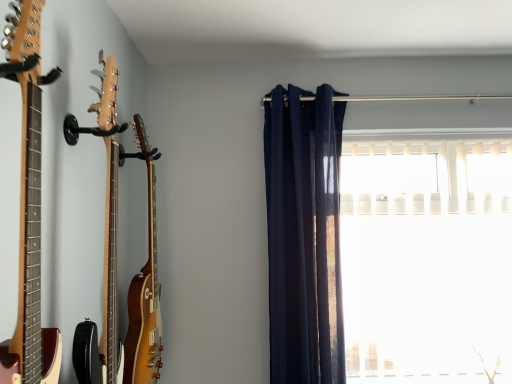
Question: Could navy blue fabric curtain at center be considered to be inside white plastic blinds at right?

Choices:
 (A) yes
 (B) no

Answer: (B)

Question: From the image's perspective, is white plastic blinds at right on top of navy blue fabric curtain at center?

Choices:
 (A) no
 (B) yes

Answer: (A)

Question: Considering the relative sizes of white plastic blinds at right and navy blue fabric curtain at center in the image provided, is white plastic blinds at right taller than navy blue fabric curtain at center?

Choices:
 (A) yes
 (B) no

Answer: (B)

Question: Is white plastic blinds at right wider than navy blue fabric curtain at center?

Choices:
 (A) no
 (B) yes

Answer: (A)

Question: Does white plastic blinds at right have a lesser height compared to navy blue fabric curtain at center?

Choices:
 (A) yes
 (B) no

Answer: (A)

Question: Is white plastic blinds at right not inside navy blue fabric curtain at center?

Choices:
 (A) no
 (B) yes

Answer: (B)

Question: From the image's perspective, is navy blue fabric curtain at center located above glossy wood guitar at left, positioned as the third guitar in front-to-back order?

Choices:
 (A) no
 (B) yes

Answer: (B)

Question: Considering the relative sizes of navy blue fabric curtain at center and glossy wood guitar at left, which is counted as the 1th guitar, starting from the back, in the image provided, is navy blue fabric curtain at center bigger than glossy wood guitar at left, which is counted as the 1th guitar, starting from the back,?

Choices:
 (A) yes
 (B) no

Answer: (A)

Question: Does navy blue fabric curtain at center have a lesser height compared to glossy wood guitar at left, positioned as the third guitar in front-to-back order?

Choices:
 (A) no
 (B) yes

Answer: (A)

Question: From a real-world perspective, is navy blue fabric curtain at center located beneath glossy wood guitar at left, which is counted as the 1th guitar, starting from the back?

Choices:
 (A) yes
 (B) no

Answer: (B)

Question: Can you confirm if navy blue fabric curtain at center is taller than glossy wood guitar at left, which is counted as the 1th guitar, starting from the back?

Choices:
 (A) yes
 (B) no

Answer: (A)

Question: Considering the relative sizes of navy blue fabric curtain at center and glossy wood guitar at left, positioned as the third guitar in front-to-back order, in the image provided, is navy blue fabric curtain at center thinner than glossy wood guitar at left, positioned as the third guitar in front-to-back order,?

Choices:
 (A) no
 (B) yes

Answer: (A)

Question: Considering the relative sizes of white plastic blinds at right and wooden acoustic guitar at left, positioned as the third guitar in back-to-front order, in the image provided, is white plastic blinds at right smaller than wooden acoustic guitar at left, positioned as the third guitar in back-to-front order,?

Choices:
 (A) no
 (B) yes

Answer: (A)